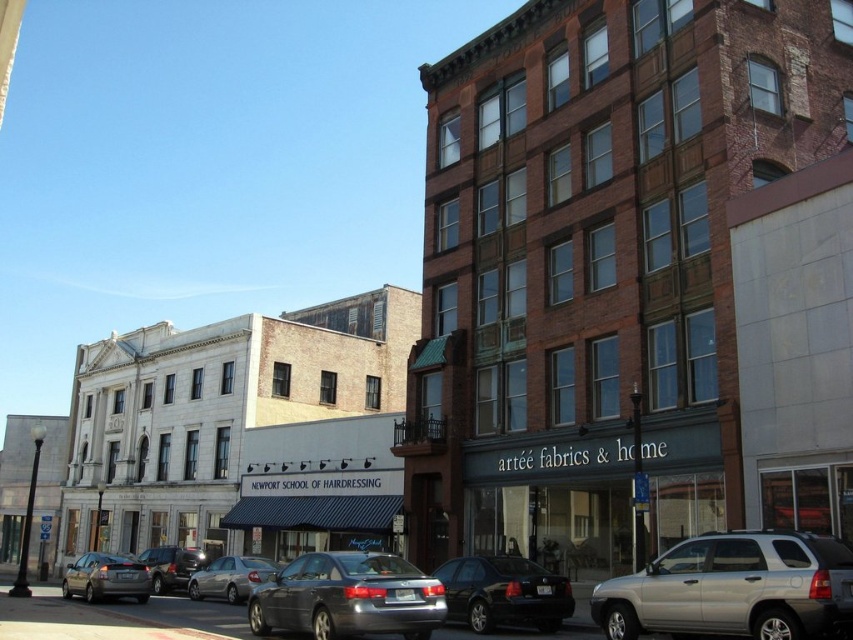
Question: Is satin silver sedan at center positioned at the back of shiny silver sedan at lower left?

Choices:
 (A) no
 (B) yes

Answer: (A)

Question: Does satin silver sedan at center appear on the right side of shiny silver sedan at lower left?

Choices:
 (A) no
 (B) yes

Answer: (B)

Question: Is silver metallic suv at lower right bigger than shiny silver sedan at lower left?

Choices:
 (A) no
 (B) yes

Answer: (A)

Question: Which object appears farthest from the camera in this image?

Choices:
 (A) matte gray sedan at lower left
 (B) satin silver sedan at center
 (C) silver metallic suv at lower right

Answer: (A)

Question: Among these objects, which one is nearest to the camera?

Choices:
 (A) matte gray sedan at lower left
 (B) silver metallic suv at lower right
 (C) silver metallic sedan at center

Answer: (B)

Question: Which point is farther to the camera?

Choices:
 (A) silver metallic suv at lower right
 (B) satin silver sedan at center
 (C) shiny black sedan at center

Answer: (C)